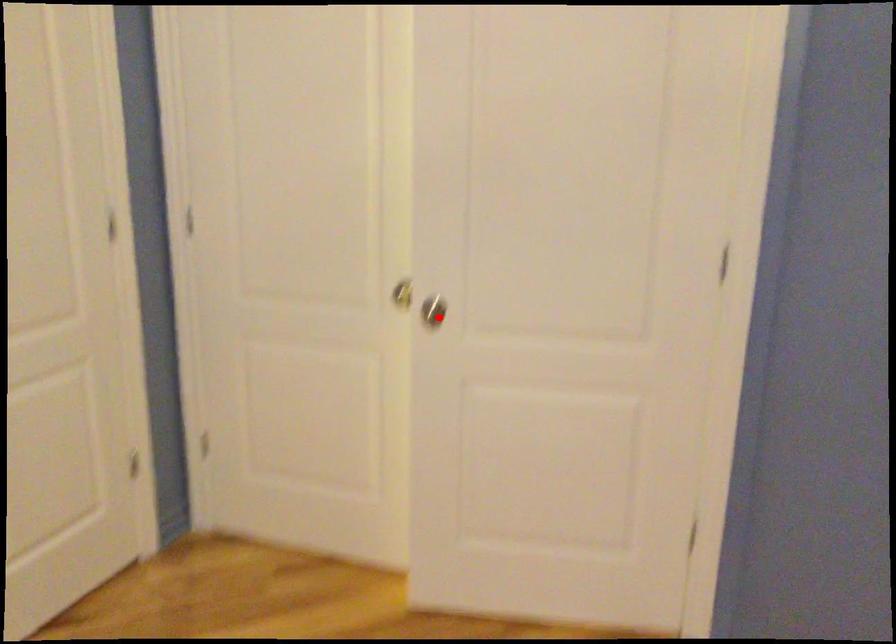
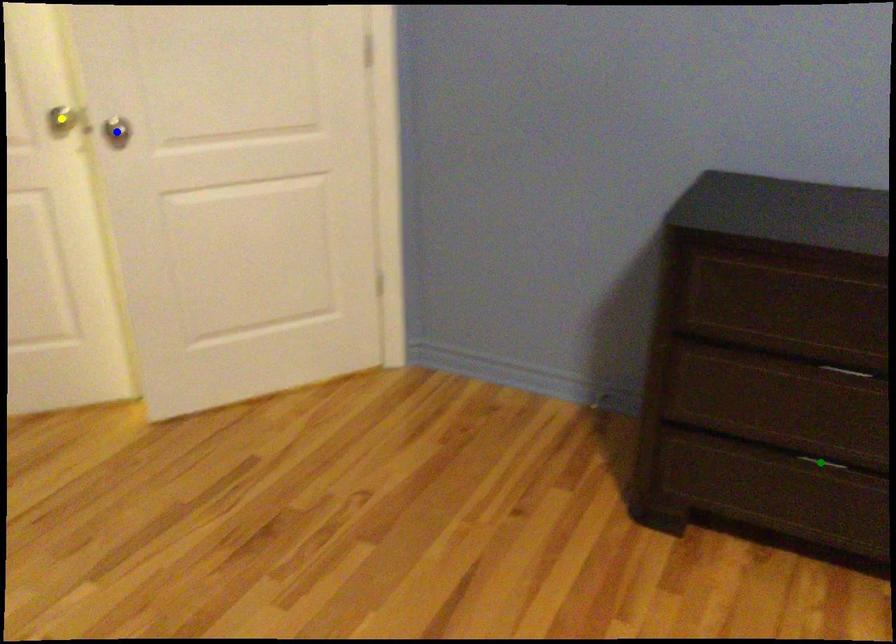
Question: I am providing you with two images of the same scene from different viewpoints. A red point is marked on the first image. You are given multiple points on the second image. Which spot in image 2 lines up with the point in image 1?

Choices:
 (A) yellow point
 (B) green point
 (C) blue point

Answer: (C)